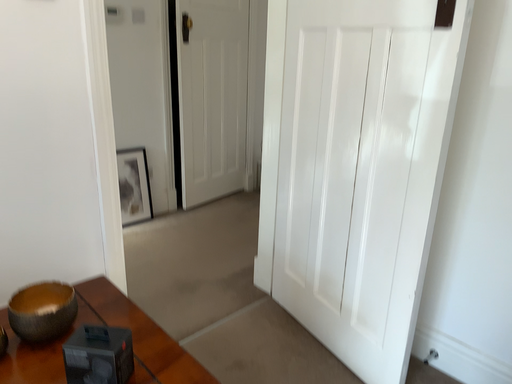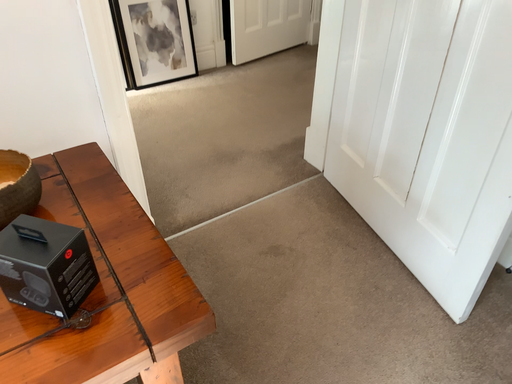
Question: Which way did the camera rotate in the video?

Choices:
 (A) rotated left
 (B) rotated right

Answer: (A)